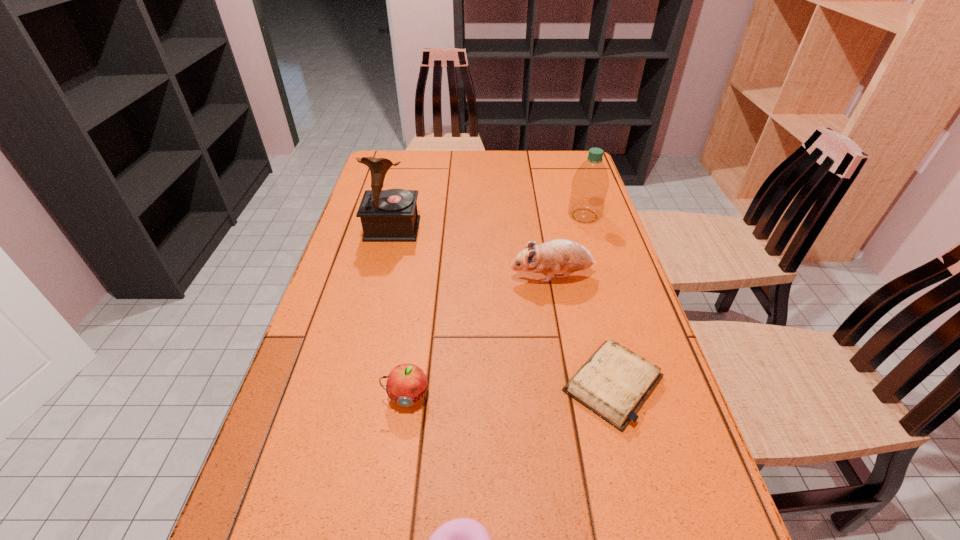
Locate an element on the screen. phonograph_record is located at coordinates (391, 215).

This screenshot has height=540, width=960. What are the coordinates of `the fifth shortest object` in the screenshot? It's located at (590, 183).

At what (x,y) coordinates should I click in order to perform the action: click on hamster. Please return your answer as a coordinate pair (x, y). This screenshot has width=960, height=540. Looking at the image, I should click on (565, 256).

You are a GUI agent. You are given a task and a screenshot of the screen. Output one action in this format:
    pyautogui.click(x=<x>, y=<y>)
    Task: Click on the fourth nearest object
    This screenshot has height=540, width=960.
    Given the screenshot: What is the action you would take?
    pyautogui.click(x=565, y=256)

Locate an element on the screen. the third shortest object is located at coordinates (407, 383).

What are the coordinates of `diary` in the screenshot? It's located at (614, 382).

You are a GUI agent. You are given a task and a screenshot of the screen. Output one action in this format:
    pyautogui.click(x=<x>, y=<y>)
    Task: Click on the free spot located 0.050m at the horn opening of the phonograph_record
    The image size is (960, 540).
    Given the screenshot: What is the action you would take?
    pyautogui.click(x=387, y=253)

Find the location of a particular element. The image size is (960, 540). vacant space situated 0.310m on the left of the water bottle is located at coordinates (470, 216).

Find the location of `vacant area located 0.090m at the face of the third tallest object`. vacant area located 0.090m at the face of the third tallest object is located at coordinates (476, 276).

Find the location of a particular element. The image size is (960, 540). vacant space located 0.250m at the face of the third tallest object is located at coordinates (417, 276).